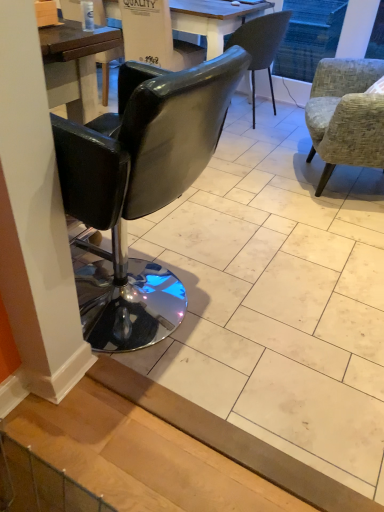
Question: Should I look upward or downward to see textured gray fabric armchair at right, which appears as the 1th chair when viewed from the right?

Choices:
 (A) down
 (B) up

Answer: (B)

Question: Is textured gray fabric armchair at right, which ranks as the 3th chair in left-to-right order, located within black leather chair at left, acting as the first chair starting from the left?

Choices:
 (A) yes
 (B) no

Answer: (B)

Question: Does black leather chair at left, acting as the first chair starting from the left, appear on the right side of textured gray fabric armchair at right, which is counted as the 2th chair, starting from the back?

Choices:
 (A) no
 (B) yes

Answer: (A)

Question: Is black leather chair at left, acting as the first chair starting from the left, turned away from textured gray fabric armchair at right, which ranks as the 3th chair in left-to-right order?

Choices:
 (A) no
 (B) yes

Answer: (A)

Question: Is black leather chair at left, acting as the first chair starting from the left, touching textured gray fabric armchair at right, which ranks as the 3th chair in left-to-right order?

Choices:
 (A) yes
 (B) no

Answer: (B)

Question: Is black leather chair at left, which ranks as the 3th chair in right-to-left order, taller than textured gray fabric armchair at right, which ranks as the 3th chair in left-to-right order?

Choices:
 (A) yes
 (B) no

Answer: (A)

Question: From the image's perspective, is black leather chair at left, acting as the first chair starting from the left, located above textured gray fabric armchair at right, which is counted as the 2th chair, starting from the back?

Choices:
 (A) no
 (B) yes

Answer: (A)

Question: Would you consider black leather chair at left, acting as the first chair starting from the left, to be distant from matte gray chair at center, marked as the 2th chair in a left-to-right arrangement?

Choices:
 (A) no
 (B) yes

Answer: (B)

Question: Is black leather chair at left, marked as the first chair in a front-to-back arrangement, smaller than matte gray chair at center, acting as the 2th chair starting from the right?

Choices:
 (A) no
 (B) yes

Answer: (A)

Question: From the image's perspective, is black leather chair at left, marked as the first chair in a front-to-back arrangement, located beneath matte gray chair at center, acting as the 3th chair starting from the front?

Choices:
 (A) no
 (B) yes

Answer: (B)

Question: Does black leather chair at left, which ranks as the 3th chair in right-to-left order, have a greater width compared to matte gray chair at center, marked as the 2th chair in a left-to-right arrangement?

Choices:
 (A) no
 (B) yes

Answer: (B)

Question: Is black leather chair at left, acting as the first chair starting from the left, further to camera compared to matte gray chair at center, marked as the 2th chair in a left-to-right arrangement?

Choices:
 (A) yes
 (B) no

Answer: (B)

Question: Is black leather chair at left, which is counted as the third chair, starting from the back, shorter than matte gray chair at center, acting as the 2th chair starting from the right?

Choices:
 (A) no
 (B) yes

Answer: (A)

Question: Does black leather armchair at center turn towards textured gray fabric armchair at right, which appears as the 1th chair when viewed from the right?

Choices:
 (A) yes
 (B) no

Answer: (B)